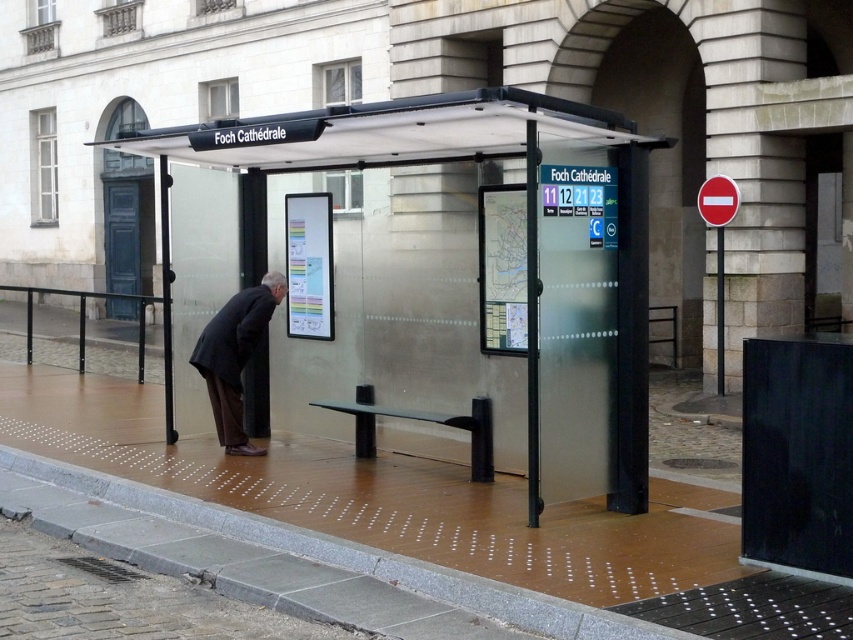
Question: Which point is closer to the camera taking this photo?

Choices:
 (A) (229, 324)
 (B) (479, 129)

Answer: (B)

Question: Which point is farther from the camera taking this photo?

Choices:
 (A) (251, 317)
 (B) (503, 99)

Answer: (A)

Question: Which point appears farthest from the camera in this image?

Choices:
 (A) (247, 289)
 (B) (614, 484)

Answer: (A)

Question: Can you confirm if transparent glass bus stop at center is bigger than dark gray suit at center?

Choices:
 (A) yes
 (B) no

Answer: (B)

Question: Is transparent glass bus stop at center thinner than dark gray suit at center?

Choices:
 (A) yes
 (B) no

Answer: (A)

Question: Is transparent glass bus stop at center behind dark gray suit at center?

Choices:
 (A) yes
 (B) no

Answer: (B)